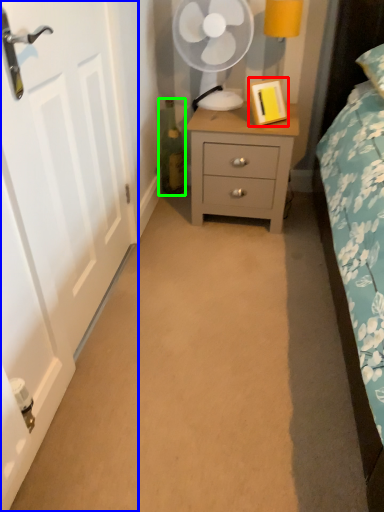
Question: Which is nearer to the picture frame (highlighted by a red box)? door (highlighted by a blue box) or bottle (highlighted by a green box).

Choices:
 (A) door
 (B) bottle

Answer: (B)